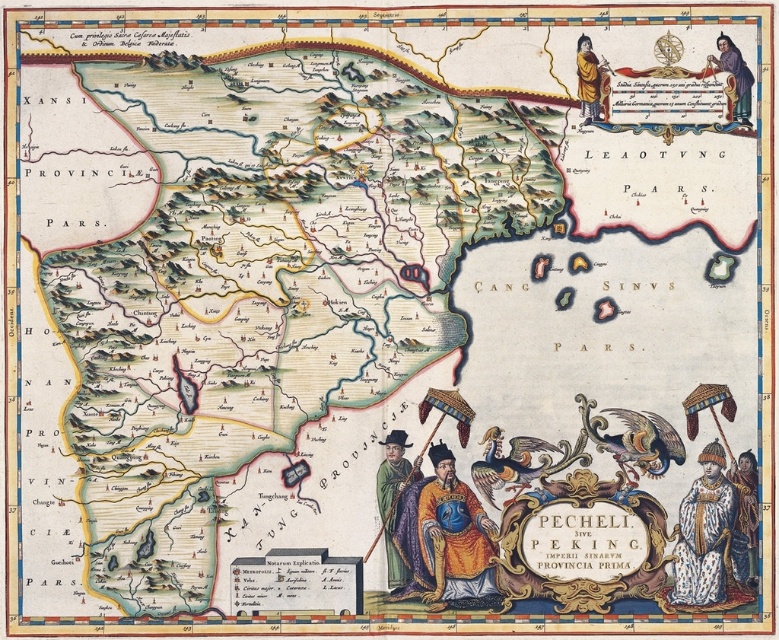
Question: Considering the relative positions of silk robe at lower right and silk robe at right in the image provided, where is silk robe at lower right located with respect to silk robe at right?

Choices:
 (A) below
 (B) above

Answer: (B)

Question: Does white fur coat at lower right have a larger size compared to smooth brown robe at upper right?

Choices:
 (A) yes
 (B) no

Answer: (A)

Question: Which of these objects is positioned farthest from the golden-yellow robe at upper right?

Choices:
 (A) golden silk robe at lower center
 (B) silk robe at right

Answer: (A)

Question: Can you confirm if golden silk robe at lower center is positioned to the left of silk robe at right?

Choices:
 (A) yes
 (B) no

Answer: (A)

Question: Which of the following is the closest to the observer?

Choices:
 (A) (583, 64)
 (B) (744, 124)

Answer: (A)

Question: Which of these objects is positioned farthest from the golden silk robe at lower center?

Choices:
 (A) silk robe at right
 (B) silk robe at lower right

Answer: (A)